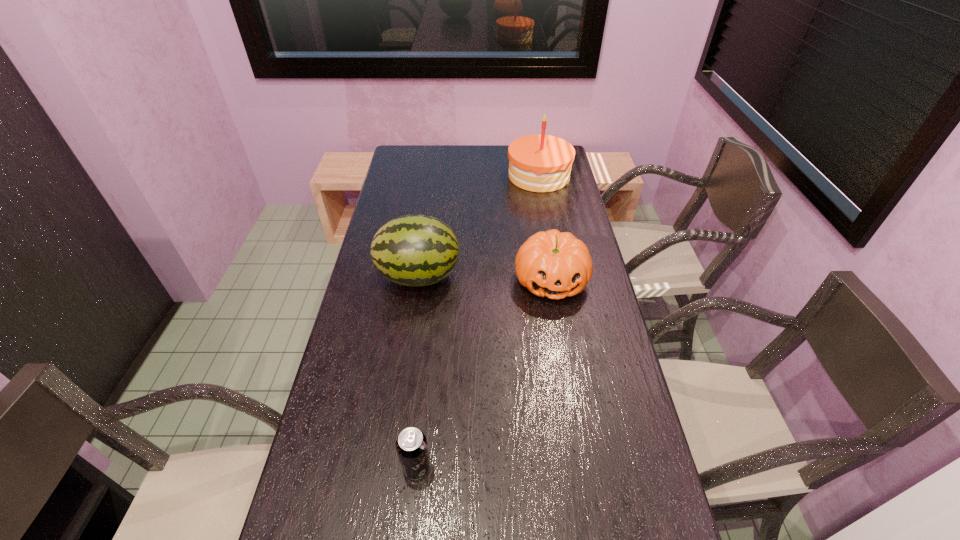
Where is `object that is at the far edge`? This screenshot has width=960, height=540. object that is at the far edge is located at coordinates (539, 163).

This screenshot has height=540, width=960. I want to click on object located at the left edge, so click(x=413, y=250).

This screenshot has height=540, width=960. Find the location of `birthday cake that is at the right edge`. birthday cake that is at the right edge is located at coordinates (539, 163).

This screenshot has width=960, height=540. Identify the location of pumpkin present at the right edge. (551, 264).

At what (x,y) coordinates should I click in order to perform the action: click on object at the far right corner. Please return your answer as a coordinate pair (x, y). This screenshot has width=960, height=540. Looking at the image, I should click on (539, 163).

You are a GUI agent. You are given a task and a screenshot of the screen. Output one action in this format:
    pyautogui.click(x=<x>, y=<y>)
    Task: Click on the vacant space at the left edge
    Image resolution: width=960 pixels, height=540 pixels.
    Given the screenshot: What is the action you would take?
    [x=422, y=179]

The height and width of the screenshot is (540, 960). I want to click on free point at the right edge, so click(x=560, y=217).

Where is `empty location between the nearest object and the third tallest object`? The image size is (960, 540). empty location between the nearest object and the third tallest object is located at coordinates (484, 374).

Identify the location of free space that is in between the birthday cake and the third shortest object. (479, 226).

At what (x,y) coordinates should I click in order to perform the action: click on empty space that is in between the farthest object and the soda can. Please return your answer as a coordinate pair (x, y). Image resolution: width=960 pixels, height=540 pixels. Looking at the image, I should click on (478, 321).